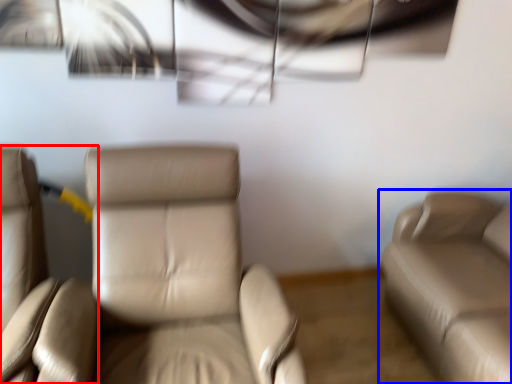
Question: Among these objects, which one is nearest to the camera, chair (highlighted by a red box) or studio couch (highlighted by a blue box)?

Choices:
 (A) chair
 (B) studio couch

Answer: (A)